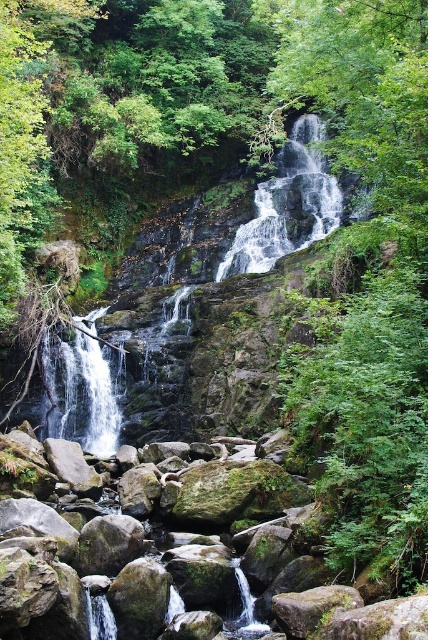
Question: Is clear water stream at center closer to camera compared to white frothy water at left?

Choices:
 (A) yes
 (B) no

Answer: (A)

Question: Which of the following is the farthest from the observer?

Choices:
 (A) (61, 380)
 (B) (297, 150)
 (C) (285, 186)

Answer: (B)

Question: Among these objects, which one is nearest to the camera?

Choices:
 (A) white frothy water at center
 (B) clear water stream at center

Answer: (B)

Question: Does clear water stream at center have a lesser width compared to white frothy water at left?

Choices:
 (A) yes
 (B) no

Answer: (B)

Question: Is clear water stream at center smaller than white frothy water at left?

Choices:
 (A) no
 (B) yes

Answer: (A)

Question: Which point appears farthest from the camera in this image?

Choices:
 (A) (320, 138)
 (B) (312, 124)

Answer: (B)